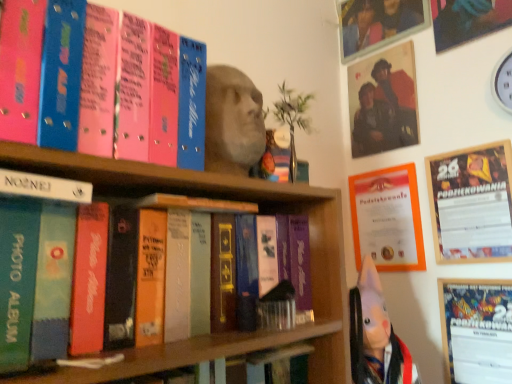
Question: Is pink matte photo album at upper left, positioned as the second book in bottom-to-top order, bigger or smaller than matte plastic photo frame at upper right, placed as the first picture frame when sorted from top to bottom?

Choices:
 (A) small
 (B) big

Answer: (B)

Question: Considering their positions, is pink matte photo album at upper left, the 1th book positioned from the top, located in front of or behind matte plastic photo frame at upper right, placed as the first picture frame when sorted from top to bottom?

Choices:
 (A) front
 (B) behind

Answer: (A)

Question: Based on their relative distances, which object is farther from the pink matte photo album at upper left, the 1th book positioned from the top?

Choices:
 (A) white matte photo album at left, which appears as the 1th book when ordered from the bottom
 (B) matte plastic photo frame at upper right, arranged as the 2th picture frame when ordered from the bottom
 (C) white plastic clock at upper right
 (D) wooden frame at upper right, marked as the 2th picture frame in a back-to-front arrangement
 (E) white paper at lower right

Answer: (C)

Question: Considering the real-world distances, which object is farthest from the orange paper certificate at upper right?

Choices:
 (A) wooden frame at upper right, which is counted as the first picture frame, starting from the front
 (B) matte plastic photo frame at upper right, the first picture frame viewed from the left
 (C) white matte photo album at left, which appears as the 1th book when ordered from the bottom
 (D) white plastic clock at upper right
 (E) white paper at lower right

Answer: (C)